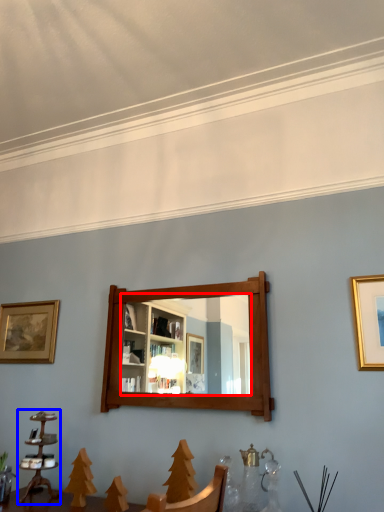
Question: Which object is further to the camera taking this photo, mirror (highlighted by a red box) or candle holder (highlighted by a blue box)?

Choices:
 (A) mirror
 (B) candle holder

Answer: (B)